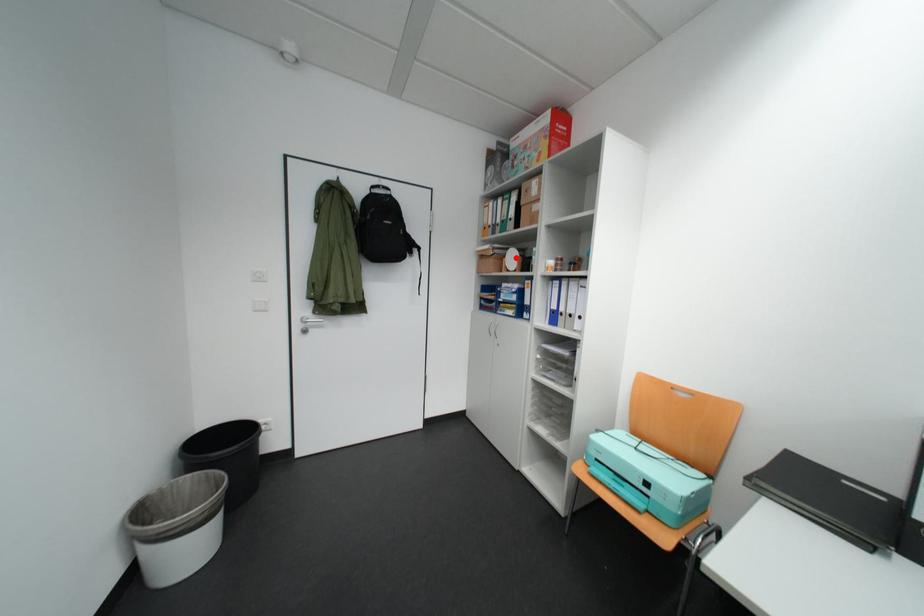
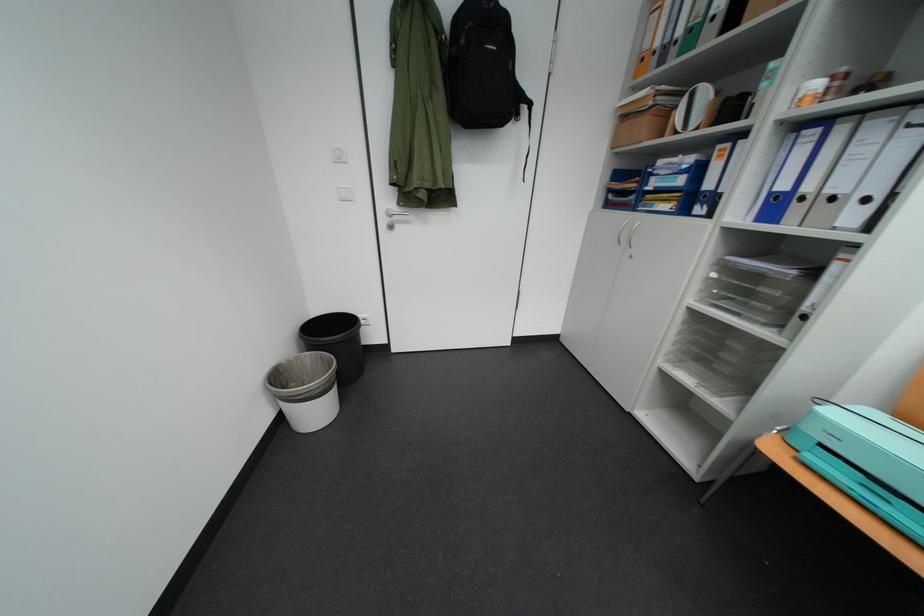
The point at the highlighted location is marked in the first image. Where is the corresponding point in the second image?

(687, 108)